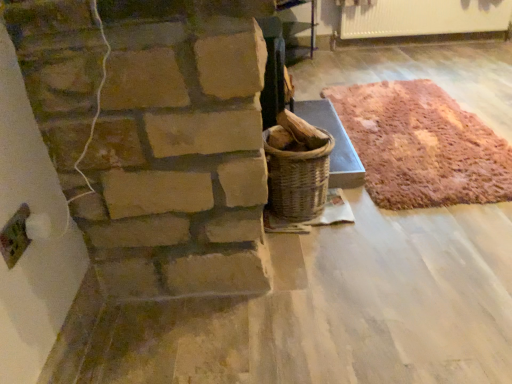
Question: From the image's perspective, is rustic woolen rug at right located above white glossy radiator at upper right?

Choices:
 (A) no
 (B) yes

Answer: (A)

Question: Can you confirm if rustic woolen rug at right is thinner than white glossy radiator at upper right?

Choices:
 (A) yes
 (B) no

Answer: (B)

Question: From a real-world perspective, is rustic woolen rug at right positioned over white glossy radiator at upper right based on gravity?

Choices:
 (A) no
 (B) yes

Answer: (A)

Question: Does rustic woolen rug at right have a greater width compared to white glossy radiator at upper right?

Choices:
 (A) no
 (B) yes

Answer: (B)

Question: Would you say rustic woolen rug at right contains white glossy radiator at upper right?

Choices:
 (A) no
 (B) yes

Answer: (A)

Question: Can you confirm if rustic woolen rug at right is bigger than white glossy radiator at upper right?

Choices:
 (A) no
 (B) yes

Answer: (B)

Question: Is rustic woolen rug at right inside white glossy radiator at upper right?

Choices:
 (A) yes
 (B) no

Answer: (B)

Question: From a real-world perspective, is white glossy radiator at upper right positioned under rustic woolen rug at right based on gravity?

Choices:
 (A) no
 (B) yes

Answer: (A)

Question: From the image's perspective, is white glossy radiator at upper right on top of rustic woolen rug at right?

Choices:
 (A) no
 (B) yes

Answer: (B)

Question: From the image's perspective, is white glossy radiator at upper right under rustic woolen rug at right?

Choices:
 (A) no
 (B) yes

Answer: (A)

Question: Considering the relative sizes of white glossy radiator at upper right and rustic woolen rug at right in the image provided, is white glossy radiator at upper right taller than rustic woolen rug at right?

Choices:
 (A) no
 (B) yes

Answer: (B)

Question: Considering the relative sizes of white glossy radiator at upper right and rustic woolen rug at right in the image provided, is white glossy radiator at upper right thinner than rustic woolen rug at right?

Choices:
 (A) yes
 (B) no

Answer: (A)

Question: Based on their sizes in the image, would you say white glossy radiator at upper right is bigger or smaller than rustic woolen rug at right?

Choices:
 (A) big
 (B) small

Answer: (B)